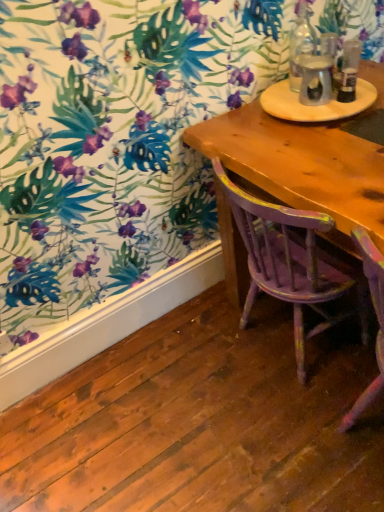
Question: Does wooden round table at upper right have a smaller size compared to distressed purple wood chair at center?

Choices:
 (A) yes
 (B) no

Answer: (A)

Question: From a real-world perspective, does wooden round table at upper right stand above distressed purple wood chair at center?

Choices:
 (A) no
 (B) yes

Answer: (B)

Question: From the image's perspective, is wooden round table at upper right on distressed purple wood chair at center?

Choices:
 (A) yes
 (B) no

Answer: (A)

Question: Does wooden round table at upper right have a greater height compared to distressed purple wood chair at center?

Choices:
 (A) yes
 (B) no

Answer: (B)

Question: Is wooden round table at upper right far away from distressed purple wood chair at center?

Choices:
 (A) no
 (B) yes

Answer: (A)

Question: Is wooden round table at upper right beside distressed purple wood chair at center?

Choices:
 (A) yes
 (B) no

Answer: (B)

Question: From the image's perspective, is clear glass bottle at upper right, which ranks as the 1th bottle in right-to-left order, under translucent glass bottle at upper right?

Choices:
 (A) yes
 (B) no

Answer: (B)

Question: Can you confirm if clear glass bottle at upper right, the 2th bottle in the left-to-right sequence, is wider than translucent glass bottle at upper right?

Choices:
 (A) yes
 (B) no

Answer: (B)

Question: Is clear glass bottle at upper right, which ranks as the 1th bottle in right-to-left order, to the left of translucent glass bottle at upper right from the viewer's perspective?

Choices:
 (A) yes
 (B) no

Answer: (B)

Question: Is clear glass bottle at upper right, the 2th bottle in the left-to-right sequence, taller than translucent glass bottle at upper right?

Choices:
 (A) yes
 (B) no

Answer: (A)

Question: Is clear glass bottle at upper right, which ranks as the 1th bottle in right-to-left order, touching translucent glass bottle at upper right?

Choices:
 (A) yes
 (B) no

Answer: (A)

Question: From the image's perspective, would you say clear glass bottle at upper right, the 2th bottle in the left-to-right sequence, is positioned over translucent glass bottle at upper right?

Choices:
 (A) no
 (B) yes

Answer: (B)

Question: From the image's perspective, is clear glass bottle at upper right, the 1th bottle viewed from the left, beneath wooden round table at upper right?

Choices:
 (A) yes
 (B) no

Answer: (B)